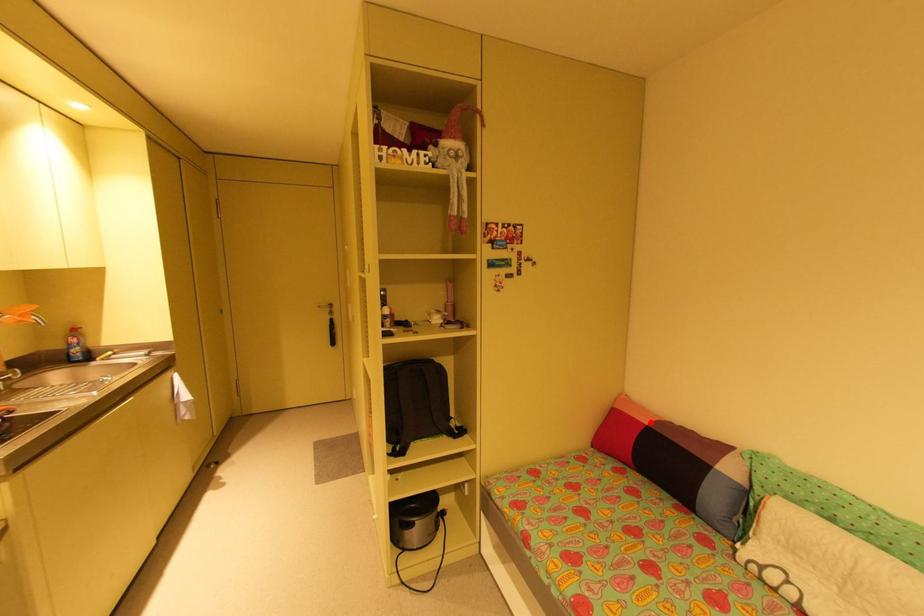
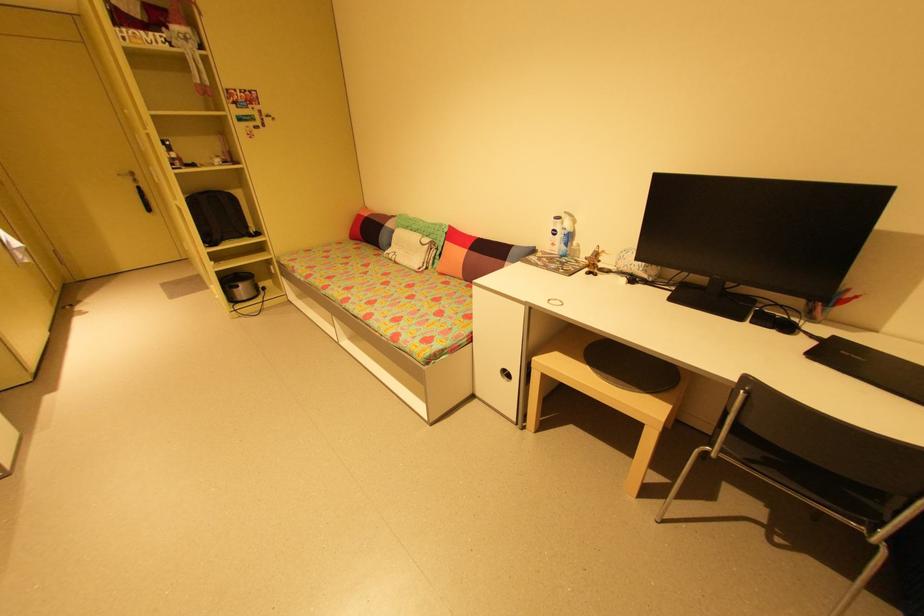
Question: I am providing you with two images of the same scene from different viewpoints. A red point is shown in image1. For the corresponding object point in image2, is it positioned nearer or farther from the camera?

Choices:
 (A) Nearer
 (B) Farther

Answer: (A)